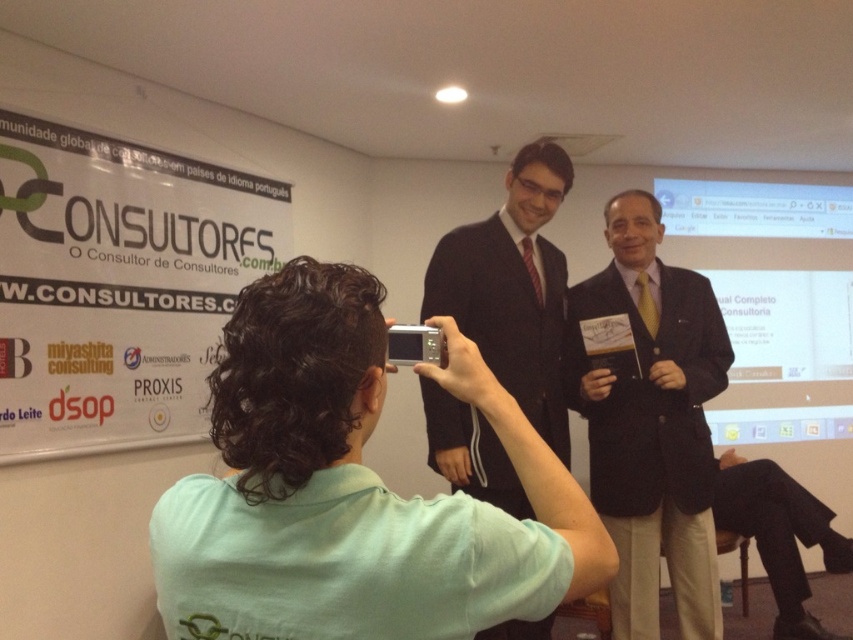
Question: Which point is closer to the camera?

Choices:
 (A) (323, 324)
 (B) (514, 310)
 (C) (70, 188)

Answer: (A)

Question: Is green fabric shirt at center thinner than dark brown suit at center?

Choices:
 (A) no
 (B) yes

Answer: (B)

Question: Among these points, which one is nearest to the camera?

Choices:
 (A) (686, 308)
 (B) (160, 209)
 (C) (438, 275)

Answer: (C)

Question: Is green fabric shirt at center positioned behind white paperboard at upper center?

Choices:
 (A) no
 (B) yes

Answer: (A)

Question: Does green fabric shirt at center appear over white paperboard at upper center?

Choices:
 (A) no
 (B) yes

Answer: (A)

Question: Which of the following is the farthest from the observer?

Choices:
 (A) (178, 221)
 (B) (297, 266)
 (C) (498, 300)
 (D) (703, 616)

Answer: (A)